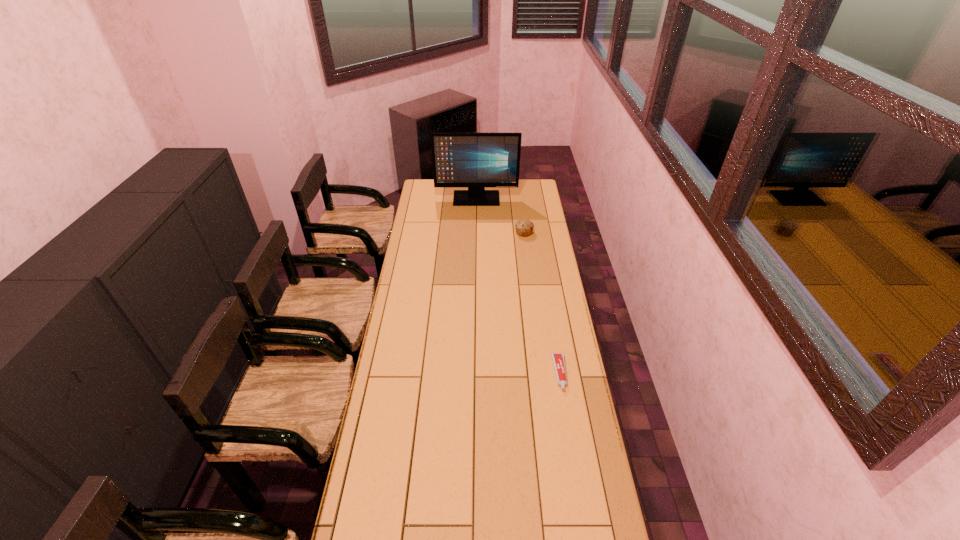
This screenshot has height=540, width=960. Identify the location of object present at the left edge. (475, 160).

At what (x,y) coordinates should I click in order to perform the action: click on monitor that is positioned at the right edge. Please return your answer as a coordinate pair (x, y). Looking at the image, I should click on (475, 160).

Find the location of a particular element. Image resolution: width=960 pixels, height=540 pixels. muffin at the right edge is located at coordinates (524, 228).

Locate an element on the screen. Image resolution: width=960 pixels, height=540 pixels. toothpaste that is at the right edge is located at coordinates (558, 359).

Where is `object present at the far left corner`? The image size is (960, 540). object present at the far left corner is located at coordinates (475, 160).

Identify the location of object present at the far right corner. (475, 160).

At what (x,y) coordinates should I click in order to perform the action: click on free region at the left edge. Please return your answer as a coordinate pair (x, y). The width and height of the screenshot is (960, 540). Looking at the image, I should click on (382, 429).

The height and width of the screenshot is (540, 960). In the image, there is a desktop. Find the location of `blank space at the right edge`. blank space at the right edge is located at coordinates (537, 284).

Find the location of a particular element. The image size is (960, 540). free space between the toothpaste and the second shortest object is located at coordinates (x=542, y=303).

This screenshot has width=960, height=540. I want to click on vacant space in between the farthest object and the muffin, so click(500, 216).